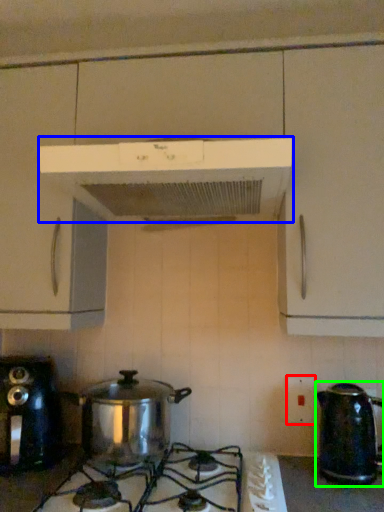
Question: Considering the real-world distances, which object is farthest from electric outlet (highlighted by a red box)? home appliance (highlighted by a blue box) or kettle (highlighted by a green box)?

Choices:
 (A) home appliance
 (B) kettle

Answer: (A)